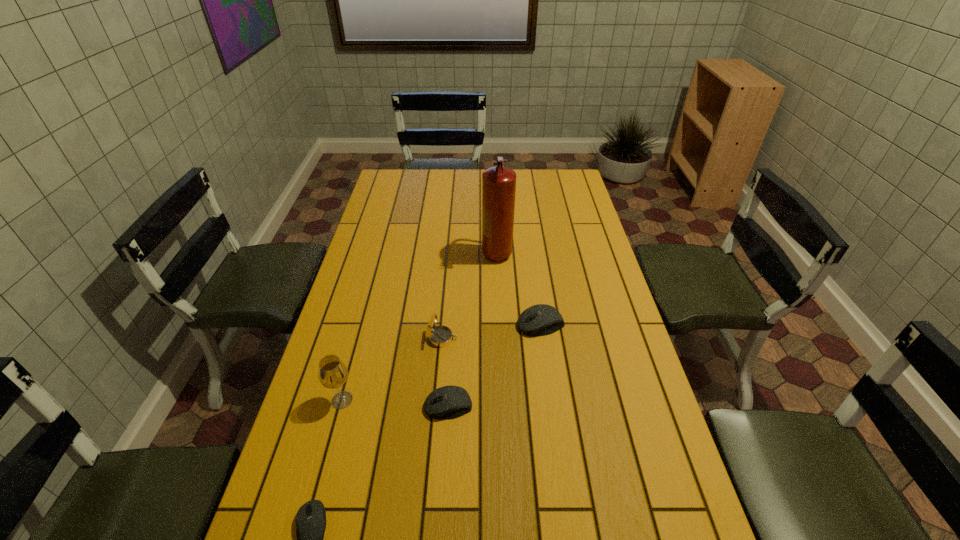
Find the location of `free space between the second shortest computer equipment and the wineglass`. free space between the second shortest computer equipment and the wineglass is located at coordinates (396, 403).

You are a GUI agent. You are given a task and a screenshot of the screen. Output one action in this format:
    pyautogui.click(x=<x>, y=<y>)
    Task: Click on the free point between the second computer equipment from left to right and the fourth shortest object
    
    Given the screenshot: What is the action you would take?
    click(444, 372)

Locate an element on the screen. This screenshot has height=540, width=960. free space between the tallest object and the second computer equipment from right to left is located at coordinates (472, 330).

This screenshot has width=960, height=540. I want to click on the closest object to the fire extinguisher, so click(x=541, y=319).

Point out which object is positioned as the fifth nearest to the tallest object. Please provide its 2D coordinates. Your answer should be formatted as a tuple, i.e. [(x, y)], where the tuple contains the x and y coordinates of a point satisfying the conditions above.

[(311, 517)]

The image size is (960, 540). I want to click on computer equipment that is the second closest to the second nearest computer equipment, so click(311, 517).

At what (x,y) coordinates should I click in order to perform the action: click on computer equipment that is the nearest to the compass. Please return your answer as a coordinate pair (x, y). The width and height of the screenshot is (960, 540). Looking at the image, I should click on (447, 402).

At what (x,y) coordinates should I click in order to perform the action: click on vacant space that satisfies the following two spatial constraints: 1. on the back side of the second tallest object; 2. on the left side of the rightmost computer equipment. Please return your answer as a coordinate pair (x, y). This screenshot has height=540, width=960. Looking at the image, I should click on click(x=363, y=324).

Where is `vacant space that satisfies the following two spatial constraints: 1. with the dial facing the compass; 2. on the left side of the second tallest computer equipment`? The height and width of the screenshot is (540, 960). vacant space that satisfies the following two spatial constraints: 1. with the dial facing the compass; 2. on the left side of the second tallest computer equipment is located at coordinates (436, 406).

This screenshot has height=540, width=960. Find the location of `free region that satisfies the following two spatial constraints: 1. with the dial facing the second computer equipment from left to right; 2. on the left side of the compass`. free region that satisfies the following two spatial constraints: 1. with the dial facing the second computer equipment from left to right; 2. on the left side of the compass is located at coordinates (436, 406).